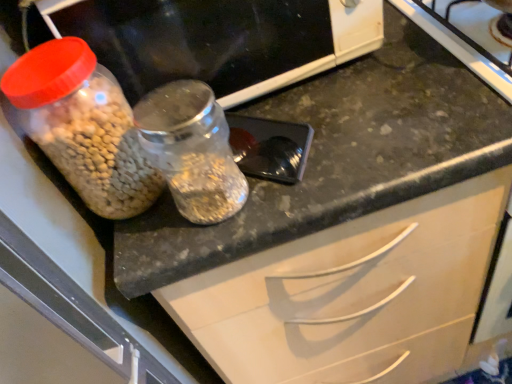
At what (x,y) coordinates should I click in order to perform the action: click on vacant region in front of metallic black spoon at center. Please return your answer as a coordinate pair (x, y). Image resolution: width=512 pixels, height=384 pixels. Looking at the image, I should click on (280, 212).